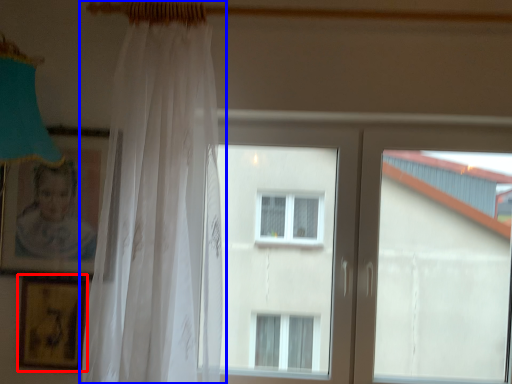
Question: Which point is closer to the camera, picture frame (highlighted by a red box) or curtain (highlighted by a blue box)?

Choices:
 (A) picture frame
 (B) curtain

Answer: (B)